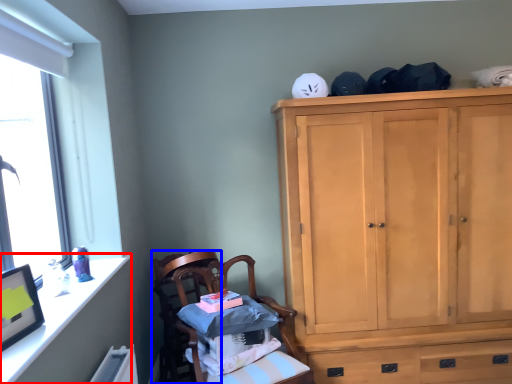
Question: Which object appears closest to the camera in this image, vanity (highlighted by a red box) or chair (highlighted by a blue box)?

Choices:
 (A) vanity
 (B) chair

Answer: (A)